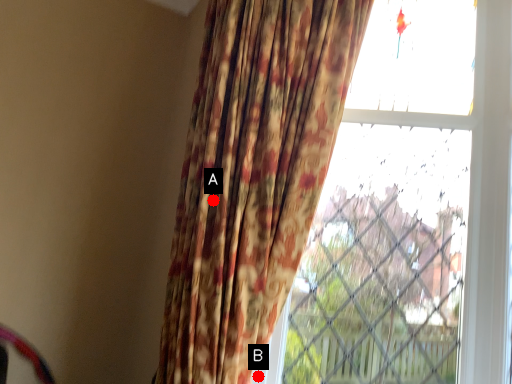
Question: Two points are circled on the image, labeled by A and B beside each circle. Among these points, which one is farthest from the camera?

Choices:
 (A) A is further
 (B) B is further

Answer: (B)